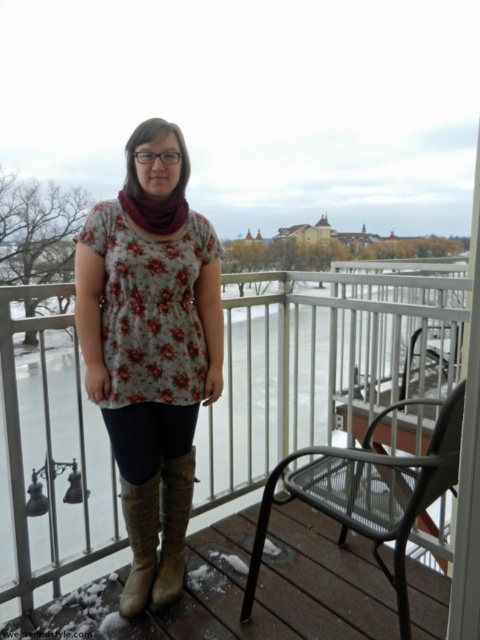
You are trying to decide which pair of boots to wear for a hike in snowy terrain. You have the brown leather boots at lower center and the leather boots at center. Based on their height, which pair would be more suitable for keeping your legs warm in the snow?

The leather boots at center are taller than the brown leather boots at lower center, making them more suitable for keeping your legs warm in snowy terrain since taller boots provide better coverage against cold weather.